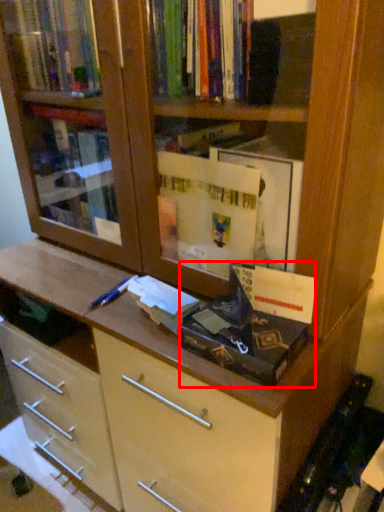
Question: Observing the image, what is the correct spatial positioning of paperback book (annotated by the red box) in reference to paperback book?

Choices:
 (A) right
 (B) left

Answer: (A)